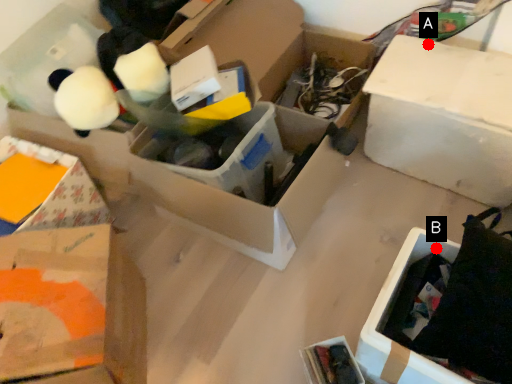
Question: Two points are circled on the image, labeled by A and B beside each circle. Which point is farther from the camera taking this photo?

Choices:
 (A) A is further
 (B) B is further

Answer: (A)